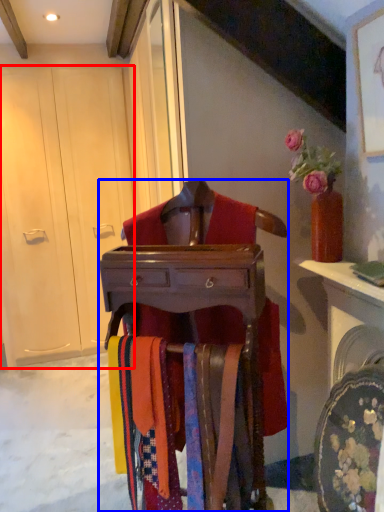
Question: Which of the following is the closest to the observer, armoire (highlighted by a red box) or furniture (highlighted by a blue box)?

Choices:
 (A) armoire
 (B) furniture

Answer: (B)